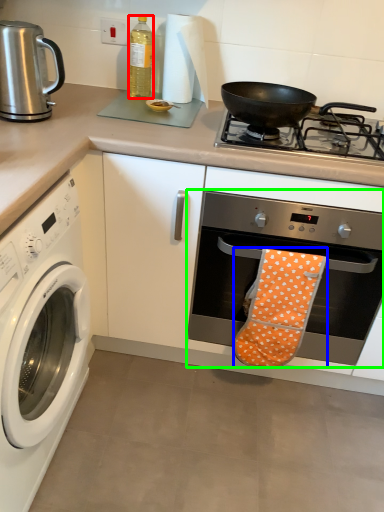
Question: Which object is the closest to the bottle (highlighted by a red box)? Choose among these: beach towel (highlighted by a blue box) or oven (highlighted by a green box).

Choices:
 (A) beach towel
 (B) oven

Answer: (B)